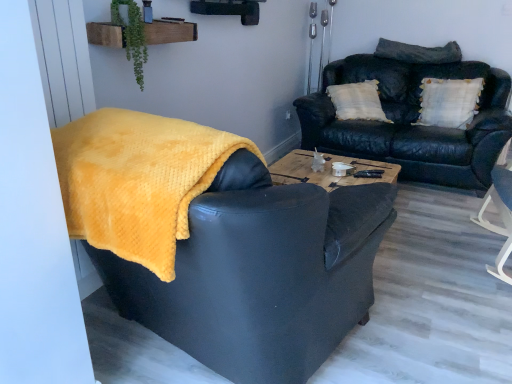
Locate an element on the screen. This screenshot has height=384, width=512. green leafy plant at upper center is located at coordinates (132, 36).

Where is `yellow fuzzy blanket at left`? yellow fuzzy blanket at left is located at coordinates (261, 274).

You are a GUI agent. You are given a task and a screenshot of the screen. Output one action in this format:
    pyautogui.click(x=<x>, y=<y>)
    Task: Click on the dark gray textured pillow at upper right, the first pillow when ordered from top to bottom
    The height and width of the screenshot is (384, 512).
    Given the screenshot: What is the action you would take?
    [418, 52]

Considering the relative sizes of yellow fuzzy blanket at left and dark gray textured pillow at upper right, the first pillow when ordered from top to bottom, in the image provided, is yellow fuzzy blanket at left smaller than dark gray textured pillow at upper right, the first pillow when ordered from top to bottom,?

Actually, yellow fuzzy blanket at left might be larger than dark gray textured pillow at upper right, the first pillow when ordered from top to bottom.

Does yellow fuzzy blanket at left lie in front of dark gray textured pillow at upper right, the first pillow when ordered from top to bottom?

That is True.

Which point is more forward, (104, 266) or (453, 49)?

Point (104, 266)

Is white textured pillow at upper right, which is counted as the second pillow, starting from the top, touching dark gray textured pillow at upper right, placed as the 2th pillow when sorted from bottom to top?

No.

Identify the location of pillow behind the white textured pillow at upper right, the first pillow in the bottom-to-top sequence. Image resolution: width=512 pixels, height=384 pixels. (418, 52).

Which object is closer to the camera taking this photo, white textured pillow at upper right, which is counted as the second pillow, starting from the top, or dark gray textured pillow at upper right, the first pillow when ordered from top to bottom?

white textured pillow at upper right, which is counted as the second pillow, starting from the top.

How different are the orientations of white textured pillow at upper right, the first pillow in the bottom-to-top sequence, and dark gray textured pillow at upper right, the first pillow when ordered from top to bottom, in degrees?

The angular difference between white textured pillow at upper right, the first pillow in the bottom-to-top sequence, and dark gray textured pillow at upper right, the first pillow when ordered from top to bottom, is 6.77 degrees.

Is green leafy plant at upper center wider than white textured pillow at upper right, the first pillow in the bottom-to-top sequence?

In fact, green leafy plant at upper center might be narrower than white textured pillow at upper right, the first pillow in the bottom-to-top sequence.

At what (x,y) coordinates should I click in order to perform the action: click on plant below the white textured pillow at upper right, the first pillow in the bottom-to-top sequence (from the image's perspective). Please return your answer as a coordinate pair (x, y). This screenshot has width=512, height=384. Looking at the image, I should click on (132, 36).

Is green leafy plant at upper center completely or partially outside of white textured pillow at upper right, the first pillow in the bottom-to-top sequence?

Yes, green leafy plant at upper center is located beyond the bounds of white textured pillow at upper right, the first pillow in the bottom-to-top sequence.

Between green leafy plant at upper center and white textured pillow at upper right, which is counted as the second pillow, starting from the top, which one appears on the right side from the viewer's perspective?

white textured pillow at upper right, which is counted as the second pillow, starting from the top, is more to the right.

Where is `the 2nd pillow counting from the right of the yellow fuzzy blanket at left`? The image size is (512, 384). the 2nd pillow counting from the right of the yellow fuzzy blanket at left is located at coordinates (449, 102).

From a real-world perspective, is yellow fuzzy blanket at left under white textured pillow at upper right, which is counted as the second pillow, starting from the top?

Yes, from a real-world perspective, yellow fuzzy blanket at left is below white textured pillow at upper right, which is counted as the second pillow, starting from the top.

Is yellow fuzzy blanket at left oriented away from white textured pillow at upper right, the first pillow in the bottom-to-top sequence?

No, yellow fuzzy blanket at left's orientation is not away from white textured pillow at upper right, the first pillow in the bottom-to-top sequence.

Does point (476, 171) appear closer or farther from the camera than point (318, 273)?

Clearly, point (476, 171) is more distant from the camera than point (318, 273).

From the picture: From the image's perspective, is leather couch at upper right located above or below yellow fuzzy blanket at left?

Clearly, from the image's perspective, leather couch at upper right is above yellow fuzzy blanket at left.

Which object is thinner, leather couch at upper right or yellow fuzzy blanket at left?

Thinner between the two is leather couch at upper right.

From a real-world perspective, is leather couch at upper right positioned under yellow fuzzy blanket at left based on gravity?

Yes, from a real-world perspective, leather couch at upper right is below yellow fuzzy blanket at left.

Is leather couch at upper right completely or partially inside dark gray textured pillow at upper right, the first pillow when ordered from top to bottom?

Definitely not — leather couch at upper right is not inside dark gray textured pillow at upper right, the first pillow when ordered from top to bottom.

Who is shorter, dark gray textured pillow at upper right, the first pillow when ordered from top to bottom, or leather couch at upper right?

dark gray textured pillow at upper right, the first pillow when ordered from top to bottom, is shorter.

Where is `the 2nd pillow behind the leather couch at upper right`? The width and height of the screenshot is (512, 384). the 2nd pillow behind the leather couch at upper right is located at coordinates (418, 52).

Which is behind, point (404, 55) or point (466, 145)?

Point (404, 55)

I want to click on studio couch located below the white textured pillow at upper right, the first pillow in the bottom-to-top sequence (from the image's perspective), so click(x=412, y=117).

Is leather couch at upper right looking in the opposite direction of white textured pillow at upper right, the first pillow in the bottom-to-top sequence?

Yes.

From the image's perspective, relative to white textured pillow at upper right, which is counted as the second pillow, starting from the top, is leather couch at upper right above or below?

leather couch at upper right is situated lower than white textured pillow at upper right, which is counted as the second pillow, starting from the top, in the image.

Image resolution: width=512 pixels, height=384 pixels. Identify the location of pillow that is the 2nd one above the yellow fuzzy blanket at left (from a real-world perspective). (418, 52).

The height and width of the screenshot is (384, 512). I want to click on pillow that is below the dark gray textured pillow at upper right, the first pillow when ordered from top to bottom (from the image's perspective), so click(449, 102).

From the picture: Estimate the real-world distances between objects in this image. Which object is further from green leafy plant at upper center, white textured pillow at upper right, which is counted as the second pillow, starting from the top, or yellow fuzzy blanket at left?

Among the two, white textured pillow at upper right, which is counted as the second pillow, starting from the top, is located further to green leafy plant at upper center.

Which object lies nearer to the anchor point white textured pillow at upper right, the first pillow in the bottom-to-top sequence, green leafy plant at upper center or dark gray textured pillow at upper right, the first pillow when ordered from top to bottom?

dark gray textured pillow at upper right, the first pillow when ordered from top to bottom, lies closer to white textured pillow at upper right, the first pillow in the bottom-to-top sequence, than the other object.

Based on their spatial positions, is yellow fuzzy blanket at left or dark gray textured pillow at upper right, placed as the 2th pillow when sorted from bottom to top, closer to leather couch at upper right?

dark gray textured pillow at upper right, placed as the 2th pillow when sorted from bottom to top, is closer to leather couch at upper right.

Based on the photo, considering their positions, is dark gray textured pillow at upper right, the first pillow when ordered from top to bottom, positioned further to yellow fuzzy blanket at left than white textured pillow at upper right, which is counted as the second pillow, starting from the top?

dark gray textured pillow at upper right, the first pillow when ordered from top to bottom.

Based on their spatial positions, is green leafy plant at upper center or leather couch at upper right closer to yellow fuzzy blanket at left?

The object closer to yellow fuzzy blanket at left is green leafy plant at upper center.

Consider the image. When comparing their distances from dark gray textured pillow at upper right, the first pillow when ordered from top to bottom, does green leafy plant at upper center or leather couch at upper right seem further?

green leafy plant at upper center is further to dark gray textured pillow at upper right, the first pillow when ordered from top to bottom.

Estimate the real-world distances between objects in this image. Which object is further from dark gray textured pillow at upper right, the first pillow when ordered from top to bottom, white textured pillow at upper right, the first pillow in the bottom-to-top sequence, or leather couch at upper right?

leather couch at upper right lies further to dark gray textured pillow at upper right, the first pillow when ordered from top to bottom, than the other object.

Based on the photo, based on their spatial positions, is dark gray textured pillow at upper right, the first pillow when ordered from top to bottom, or leather couch at upper right closer to yellow fuzzy blanket at left?

The object closer to yellow fuzzy blanket at left is leather couch at upper right.

The height and width of the screenshot is (384, 512). I want to click on pillow between green leafy plant at upper center and white textured pillow at upper right, which is counted as the second pillow, starting from the top, from left to right, so click(x=418, y=52).

Where is `pillow positioned between yellow fuzzy blanket at left and dark gray textured pillow at upper right, placed as the 2th pillow when sorted from bottom to top, from near to far`? The image size is (512, 384). pillow positioned between yellow fuzzy blanket at left and dark gray textured pillow at upper right, placed as the 2th pillow when sorted from bottom to top, from near to far is located at coordinates (449, 102).

Find the location of a particular element. The image size is (512, 384). studio couch situated between green leafy plant at upper center and dark gray textured pillow at upper right, the first pillow when ordered from top to bottom, from left to right is located at coordinates (412, 117).

At what (x,y) coordinates should I click in order to perform the action: click on studio couch between yellow fuzzy blanket at left and dark gray textured pillow at upper right, placed as the 2th pillow when sorted from bottom to top, from front to back. Please return your answer as a coordinate pair (x, y). This screenshot has height=384, width=512. Looking at the image, I should click on (412, 117).